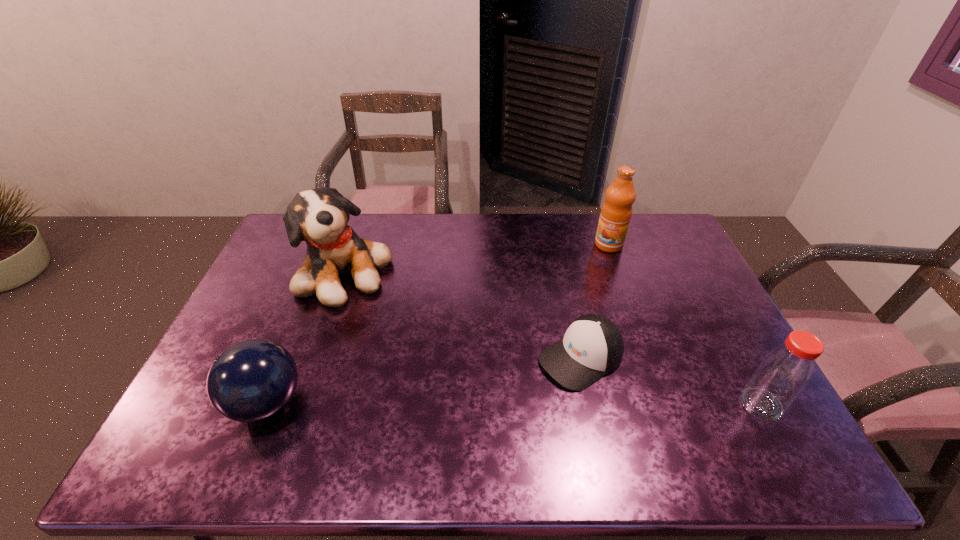
The image size is (960, 540). In order to click on free space on the desktop that is between the bowling ball and the rightmost object and is positioned on the front panel of the cap in this screenshot , I will do `click(512, 403)`.

The image size is (960, 540). I want to click on free space on the desktop that is between the second shortest object and the bottle and is positioned on the label side of the fruit juice, so tap(516, 403).

Find the location of a particular element. free space on the desktop that is between the bowling ball and the third shortest object and is positioned at the face of the puppy is located at coordinates (508, 403).